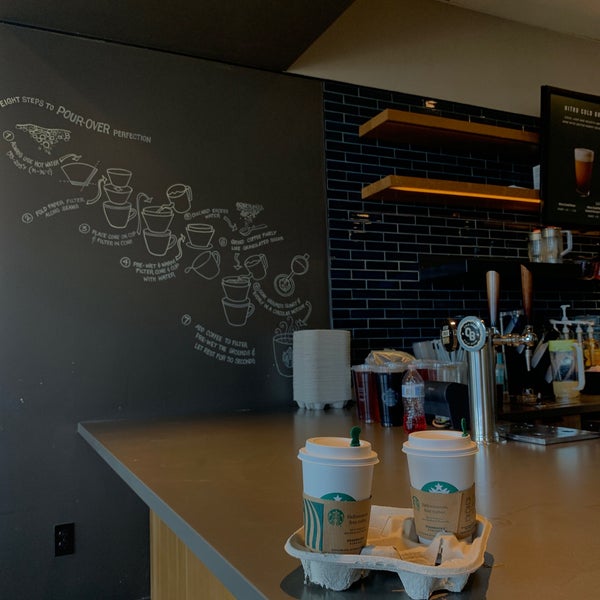
I want to click on starbucks coffee cups, so click(x=337, y=481), click(x=439, y=462).